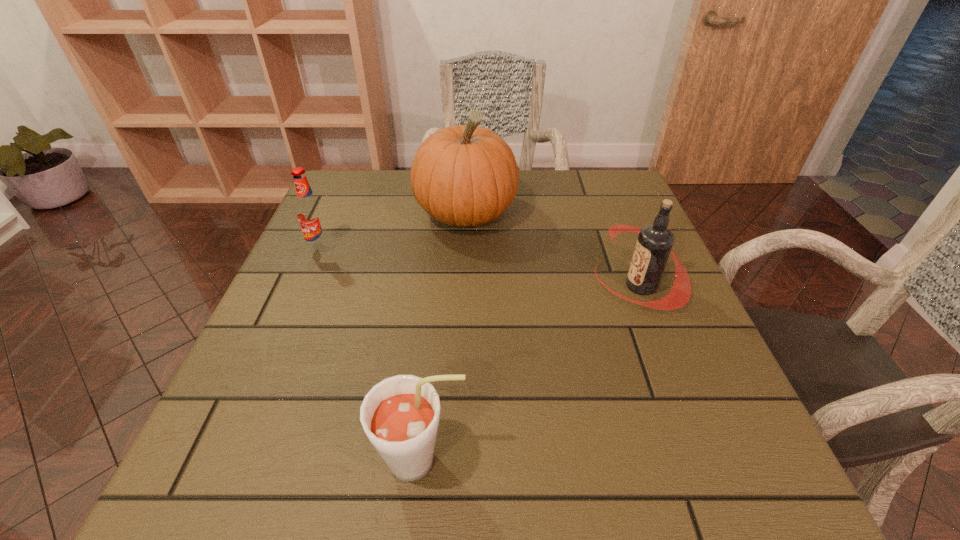
Find the location of `vacant region located on the label of the rightmost root beer`. vacant region located on the label of the rightmost root beer is located at coordinates (498, 286).

At what (x,y) coordinates should I click in order to perform the action: click on vacant space located on the back of the leftmost object. Please return your answer as a coordinate pair (x, y). This screenshot has width=960, height=540. Looking at the image, I should click on (339, 207).

At what (x,y) coordinates should I click in order to perform the action: click on free spot located 0.100m on the drink side of the nearest object. Please return your answer as a coordinate pair (x, y). Looking at the image, I should click on (535, 461).

Locate an element on the screen. The width and height of the screenshot is (960, 540). object that is at the far edge is located at coordinates (465, 175).

This screenshot has height=540, width=960. Find the location of `object present at the near edge`. object present at the near edge is located at coordinates (400, 415).

Locate an element on the screen. This screenshot has height=540, width=960. object situated at the left edge is located at coordinates (310, 214).

You are a GUI agent. You are given a task and a screenshot of the screen. Output one action in this format:
    pyautogui.click(x=<x>, y=<y>)
    Task: Click on the object at the right edge
    
    Given the screenshot: What is the action you would take?
    654,244

This screenshot has height=540, width=960. Identify the location of blank area at the far edge. (519, 201).

In the image, there is a desktop. Identify the location of vacant space at the near edge. (450, 450).

Where is `vacant space at the left edge of the desktop`? The width and height of the screenshot is (960, 540). vacant space at the left edge of the desktop is located at coordinates (225, 437).